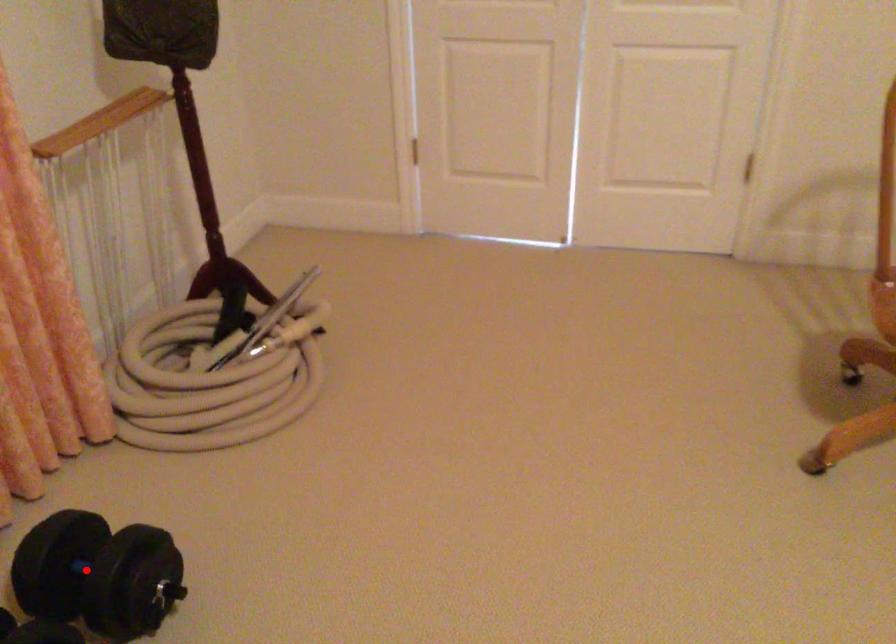
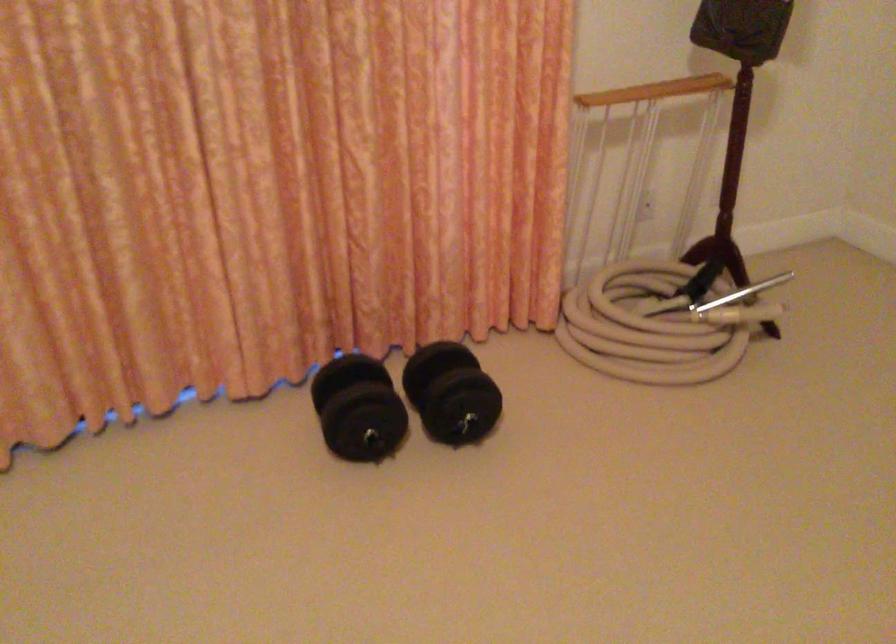
Question: I am providing you with two images of the same scene from different viewpoints. In image1, a red point is highlighted. Considering the same 3D point in image2, which of the following is correct?

Choices:
 (A) It is closer
 (B) It is farther

Answer: (B)